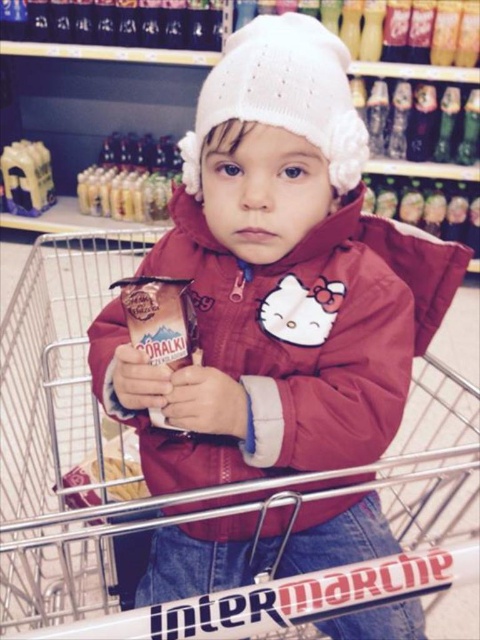
Can you confirm if metallic silver shopping cart at center is positioned to the left of white knitted hat at upper center?

Yes, metallic silver shopping cart at center is to the left of white knitted hat at upper center.

Is metallic silver shopping cart at center shorter than white knitted hat at upper center?

No, metallic silver shopping cart at center is not shorter than white knitted hat at upper center.

Is point (8, 371) farther from camera compared to point (344, 100)?

Yes, it is.

Find the location of a particular element. Image resolution: width=480 pixels, height=640 pixels. metallic silver shopping cart at center is located at coordinates (183, 492).

Is metallic silver shopping cart at center to the right of matte red jacket at center from the viewer's perspective?

In fact, metallic silver shopping cart at center is to the left of matte red jacket at center.

Who is lower down, metallic silver shopping cart at center or matte red jacket at center?

Positioned lower is metallic silver shopping cart at center.

Does point (57, 336) come farther from viewer compared to point (144, 442)?

Yes.

The width and height of the screenshot is (480, 640). Identify the location of metallic silver shopping cart at center. (183, 492).

Between point (273, 406) and point (312, 54), which one is positioned in front?

Point (273, 406) is more forward.

What do you see at coordinates (276, 353) in the screenshot? I see `matte red jacket at center` at bounding box center [276, 353].

Which is in front, point (323, 376) or point (299, 80)?

Point (299, 80)

Locate an element on the screen. The width and height of the screenshot is (480, 640). matte red jacket at center is located at coordinates (276, 353).